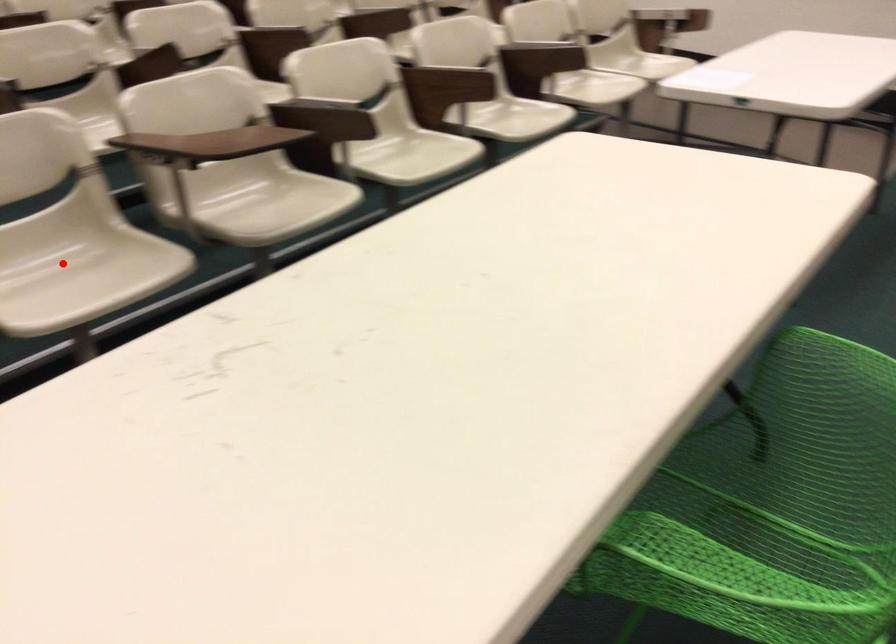
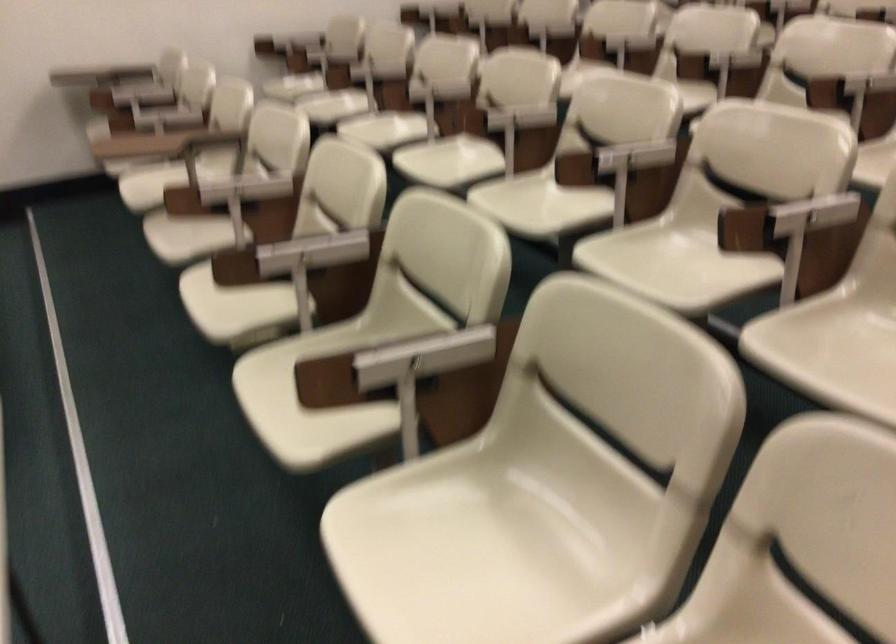
Question: I am providing you with two images of the same scene from different viewpoints. A red point is marked on the first image. At the location where the point appears in image 1, is it still visible in image 2?

Choices:
 (A) Yes
 (B) No

Answer: (B)